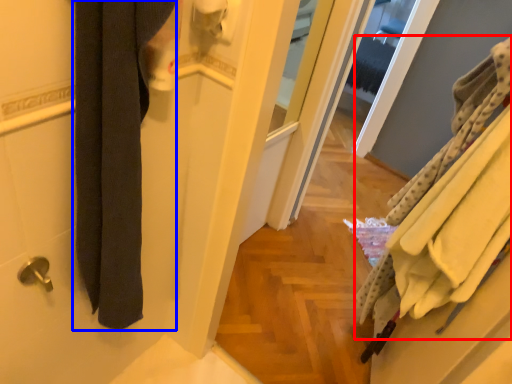
Question: Which point is closer to the camera, bath towel (highlighted by a red box) or bath towel (highlighted by a blue box)?

Choices:
 (A) bath towel
 (B) bath towel

Answer: (B)